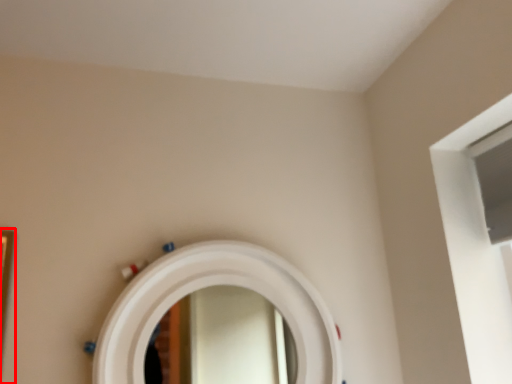
Question: From the image's perspective, where is picture frame (annotated by the red box) located in relation to mirror in the image?

Choices:
 (A) above
 (B) below

Answer: (A)